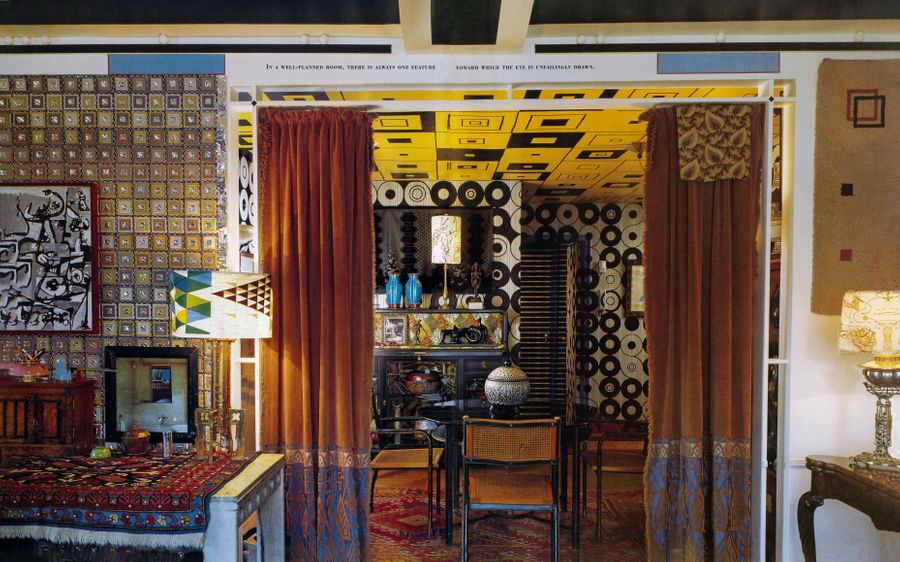
Identify the location of back of chair. (502, 447).